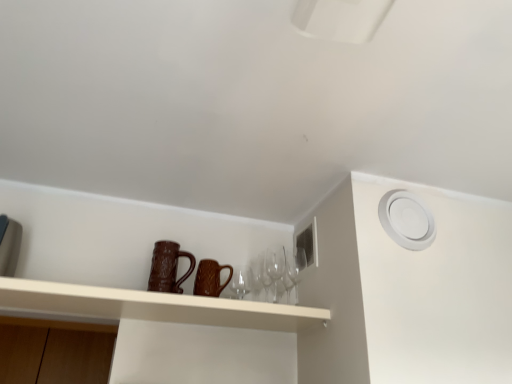
Question: Is transparent glass wine glasses at center, the 2th wine glass positioned from the right, at the left side of brown textured mug at center, the second mug from the left?

Choices:
 (A) yes
 (B) no

Answer: (B)

Question: Is transparent glass wine glasses at center, which is counted as the first wine glass, starting from the left, facing towards brown textured mug at center, the second mug from the left?

Choices:
 (A) no
 (B) yes

Answer: (A)

Question: Is transparent glass wine glasses at center, which is counted as the first wine glass, starting from the left, to the right of brown textured mug at center, the second mug from the left, from the viewer's perspective?

Choices:
 (A) no
 (B) yes

Answer: (B)

Question: Is transparent glass wine glasses at center, the 2th wine glass positioned from the right, positioned with its back to brown textured mug at center, acting as the 1th mug starting from the right?

Choices:
 (A) no
 (B) yes

Answer: (A)

Question: From a real-world perspective, does transparent glass wine glasses at center, the 2th wine glass positioned from the right, stand above brown textured mug at center, the second mug from the left?

Choices:
 (A) no
 (B) yes

Answer: (B)

Question: From the image's perspective, is transparent glass wine glasses at center, the 2th wine glass positioned from the right, on brown textured mug at center, acting as the 1th mug starting from the right?

Choices:
 (A) no
 (B) yes

Answer: (A)

Question: Does transparent glass wine glasses at center, the 2th wine glass positioned from the right, come in front of matte brown mugs at center?

Choices:
 (A) no
 (B) yes

Answer: (A)

Question: Would you say transparent glass wine glasses at center, the 2th wine glass positioned from the right, contains matte brown mugs at center?

Choices:
 (A) yes
 (B) no

Answer: (B)

Question: From a real-world perspective, does transparent glass wine glasses at center, which is counted as the first wine glass, starting from the left, sit lower than matte brown mugs at center?

Choices:
 (A) yes
 (B) no

Answer: (B)

Question: Considering the relative positions of transparent glass wine glasses at center, the 2th wine glass positioned from the right, and matte brown mugs at center in the image provided, is transparent glass wine glasses at center, the 2th wine glass positioned from the right, to the left of matte brown mugs at center from the viewer's perspective?

Choices:
 (A) yes
 (B) no

Answer: (B)

Question: Considering the relative sizes of transparent glass wine glasses at center, which is counted as the first wine glass, starting from the left, and matte brown mugs at center in the image provided, is transparent glass wine glasses at center, which is counted as the first wine glass, starting from the left, taller than matte brown mugs at center?

Choices:
 (A) no
 (B) yes

Answer: (B)

Question: Can you confirm if transparent glass wine glasses at center, the 2th wine glass positioned from the right, is bigger than matte brown mugs at center?

Choices:
 (A) no
 (B) yes

Answer: (A)

Question: Considering the relative sizes of matte brown mugs at center and transparent glass wine glass at center, the second wine glass when ordered from left to right, in the image provided, is matte brown mugs at center wider than transparent glass wine glass at center, the second wine glass when ordered from left to right,?

Choices:
 (A) yes
 (B) no

Answer: (A)